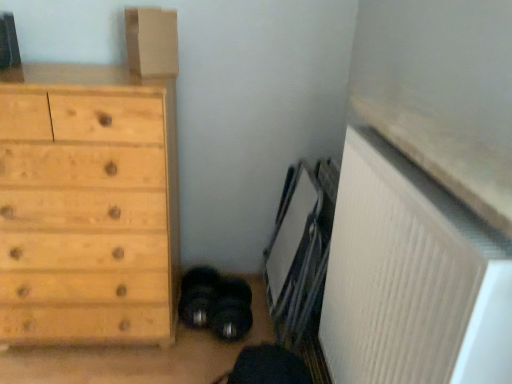
Question: Can you confirm if natural wood chest of drawers at left is positioned to the right of matte cardboard box at upper left?

Choices:
 (A) yes
 (B) no

Answer: (B)

Question: Can you confirm if natural wood chest of drawers at left is thinner than matte cardboard box at upper left?

Choices:
 (A) yes
 (B) no

Answer: (B)

Question: From the image's perspective, is natural wood chest of drawers at left beneath matte cardboard box at upper left?

Choices:
 (A) yes
 (B) no

Answer: (A)

Question: From a real-world perspective, is natural wood chest of drawers at left over matte cardboard box at upper left?

Choices:
 (A) no
 (B) yes

Answer: (A)

Question: Considering the relative sizes of natural wood chest of drawers at left and matte cardboard box at upper left in the image provided, is natural wood chest of drawers at left smaller than matte cardboard box at upper left?

Choices:
 (A) yes
 (B) no

Answer: (B)

Question: From a real-world perspective, is natural wood chest of drawers at left positioned under matte cardboard box at upper left based on gravity?

Choices:
 (A) no
 (B) yes

Answer: (B)

Question: Can you confirm if white ribbed radiator at lower right is bigger than matte cardboard box at upper left?

Choices:
 (A) yes
 (B) no

Answer: (A)

Question: From the image's perspective, is white ribbed radiator at lower right above matte cardboard box at upper left?

Choices:
 (A) no
 (B) yes

Answer: (A)

Question: Does white ribbed radiator at lower right appear on the right side of matte cardboard box at upper left?

Choices:
 (A) no
 (B) yes

Answer: (B)

Question: From the image's perspective, does white ribbed radiator at lower right appear lower than matte cardboard box at upper left?

Choices:
 (A) no
 (B) yes

Answer: (B)

Question: From a real-world perspective, is white ribbed radiator at lower right physically below matte cardboard box at upper left?

Choices:
 (A) no
 (B) yes

Answer: (B)

Question: Is the depth of white ribbed radiator at lower right greater than that of matte cardboard box at upper left?

Choices:
 (A) yes
 (B) no

Answer: (B)

Question: Is matte cardboard box at upper left turned away from white ribbed radiator at lower right?

Choices:
 (A) yes
 (B) no

Answer: (B)